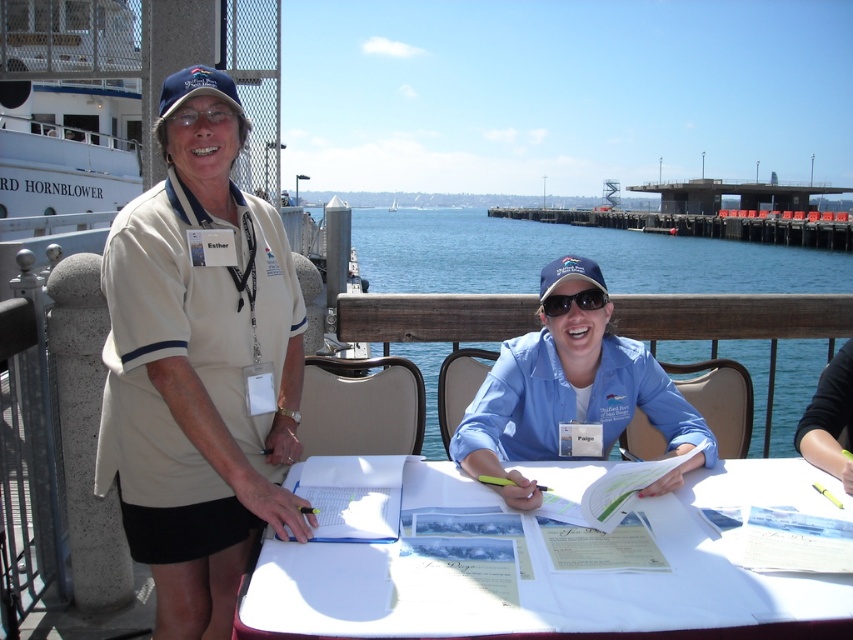
Based on the scene description, where exactly is the beige fabric shirt at left located in terms of coordinates?

The beige fabric shirt at left is located at coordinates point (200, 364).

You are a photographer at the event. You need to capture a photo of the white paper at center without the beige fabric shirt at left blocking it. How can you adjust your position to achieve this?

The beige fabric shirt at left is located above the white paper at center, so you can lower your camera angle to capture the white paper at center without the beige fabric shirt at left blocking it.